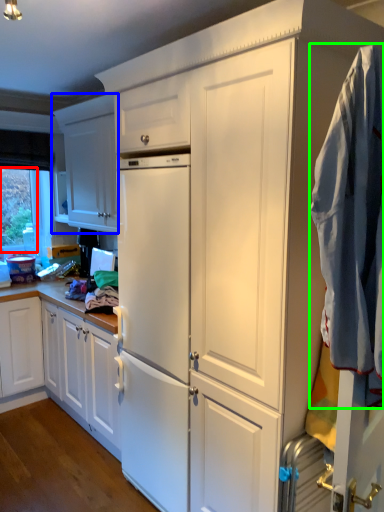
Question: Based on their relative distances, which object is nearer to window screen (highlighted by a red box)? Choose from cabinetry (highlighted by a blue box) and clothing (highlighted by a green box).

Choices:
 (A) cabinetry
 (B) clothing

Answer: (A)